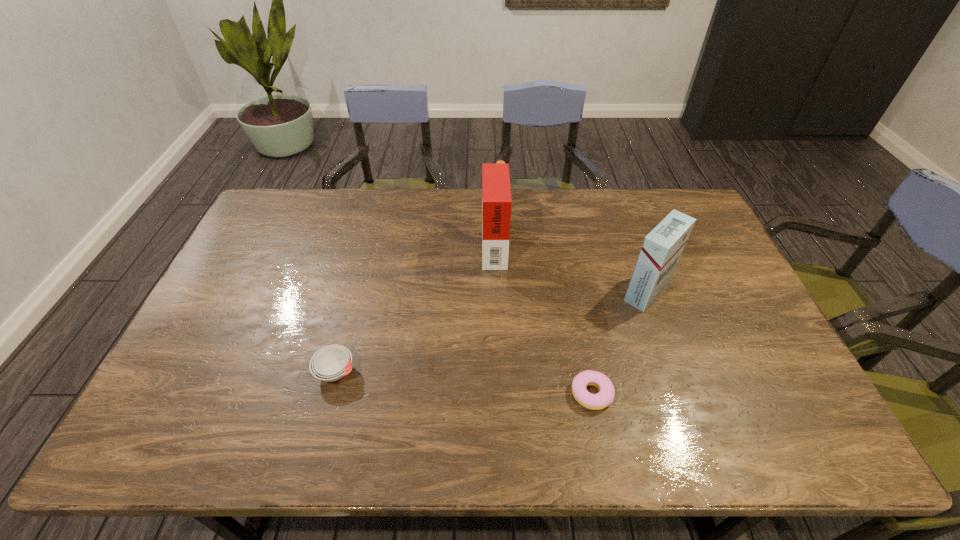
You are a GUI agent. You are given a task and a screenshot of the screen. Output one action in this format:
    pyautogui.click(x=<x>, y=<y>)
    Task: Click on the free point located on the front-facing side of the farther cigarette case
    The width and height of the screenshot is (960, 540).
    Given the screenshot: What is the action you would take?
    pyautogui.click(x=452, y=244)

Identify the location of vacant space located on the back of the right cigarette case. (636, 259).

Where is `vacant space situated 0.290m on the back of the soup bowl`? This screenshot has height=540, width=960. vacant space situated 0.290m on the back of the soup bowl is located at coordinates (361, 275).

Locate an element on the screen. This screenshot has height=540, width=960. free space located on the right of the third object from left to right is located at coordinates (731, 393).

Identify the location of object that is at the far edge. The height and width of the screenshot is (540, 960). (496, 194).

The height and width of the screenshot is (540, 960). I want to click on free space at the far edge of the desktop, so click(x=382, y=230).

What are the coordinates of `free space at the near edge of the desktop` in the screenshot? It's located at (479, 433).

This screenshot has width=960, height=540. Find the location of `vacant area at the left edge`. vacant area at the left edge is located at coordinates (276, 238).

In the image, there is a desktop. At what (x,y) coordinates should I click in order to perform the action: click on free region at the right edge. Please return your answer as a coordinate pair (x, y). Looking at the image, I should click on (750, 344).

Where is `vacant space at the far left corner`? vacant space at the far left corner is located at coordinates (262, 216).